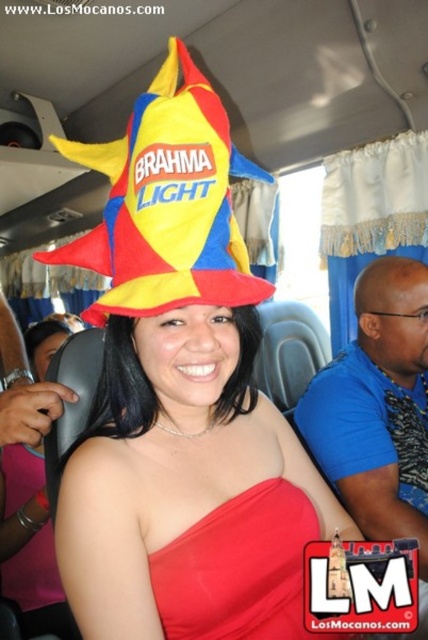
You are a passenger on the bus and want to place a small item between the two points, point (380, 522) and point (169, 588). Which point is closer to you so you can reach it first?

Point (380, 522) is closer to you than point (169, 588), so you can reach it first.

You are a photographer trying to capture the red satin dress at center without the polyester flag at center blocking the view. Can you move the flag to the side?

The polyester flag at center is positioned over red satin dress at center, so you can move it to the side to avoid blocking the view.